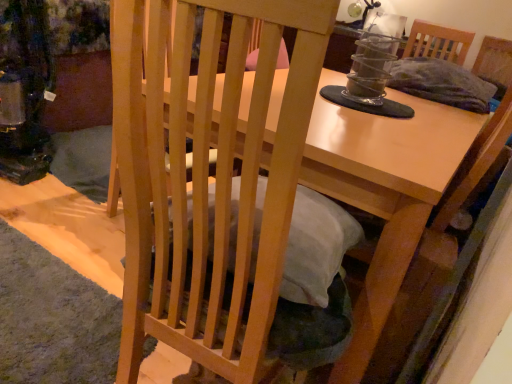
Question: Considering the positions of light brown wooden table at center and natural wood chair at center in the image, is light brown wooden table at center taller or shorter than natural wood chair at center?

Choices:
 (A) tall
 (B) short

Answer: (B)

Question: Considering the positions of light brown wooden table at center and natural wood chair at center in the image, is light brown wooden table at center bigger or smaller than natural wood chair at center?

Choices:
 (A) small
 (B) big

Answer: (B)

Question: From a real-world perspective, relative to natural wood chair at center, is light brown wooden table at center vertically above or below?

Choices:
 (A) below
 (B) above

Answer: (A)

Question: Considering the positions of point pyautogui.click(x=291, y=137) and point pyautogui.click(x=364, y=205), is point pyautogui.click(x=291, y=137) closer or farther from the camera than point pyautogui.click(x=364, y=205)?

Choices:
 (A) closer
 (B) farther

Answer: (A)

Question: Is natural wood chair at center to the left or to the right of light brown wooden table at center in the image?

Choices:
 (A) left
 (B) right

Answer: (A)

Question: Looking at the image, does natural wood chair at center seem bigger or smaller compared to light brown wooden table at center?

Choices:
 (A) small
 (B) big

Answer: (A)

Question: In terms of height, does natural wood chair at center look taller or shorter compared to light brown wooden table at center?

Choices:
 (A) short
 (B) tall

Answer: (B)